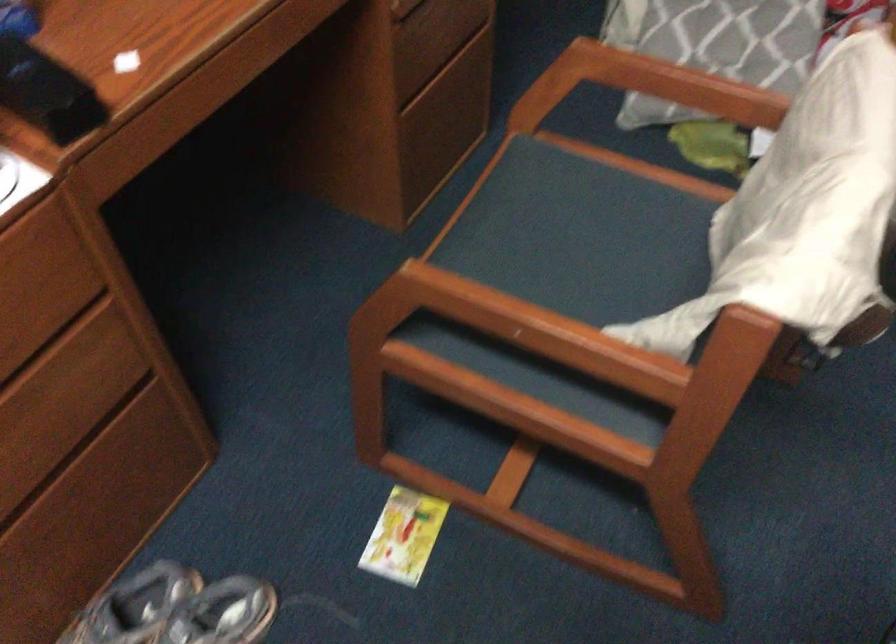
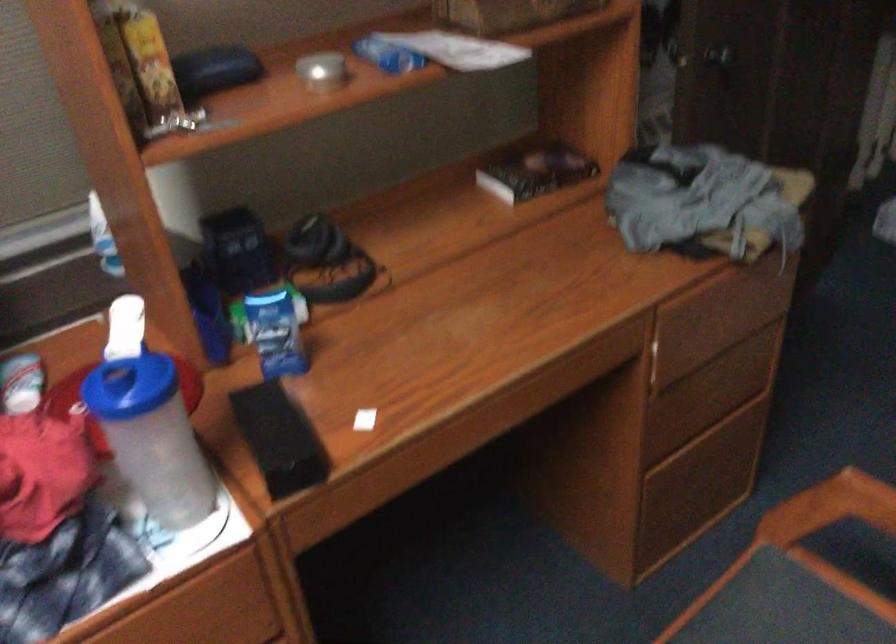
The point at (564,84) is marked in the first image. Where is the corresponding point in the second image?

(830, 507)